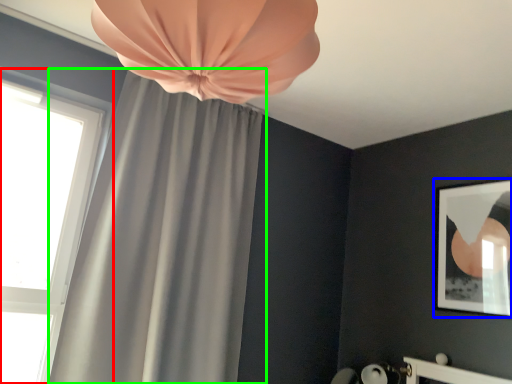
Question: Estimate the real-world distances between objects in this image. Which object is closer to window (highlighted by a red box), picture frame (highlighted by a blue box) or curtain (highlighted by a green box)?

Choices:
 (A) picture frame
 (B) curtain

Answer: (B)